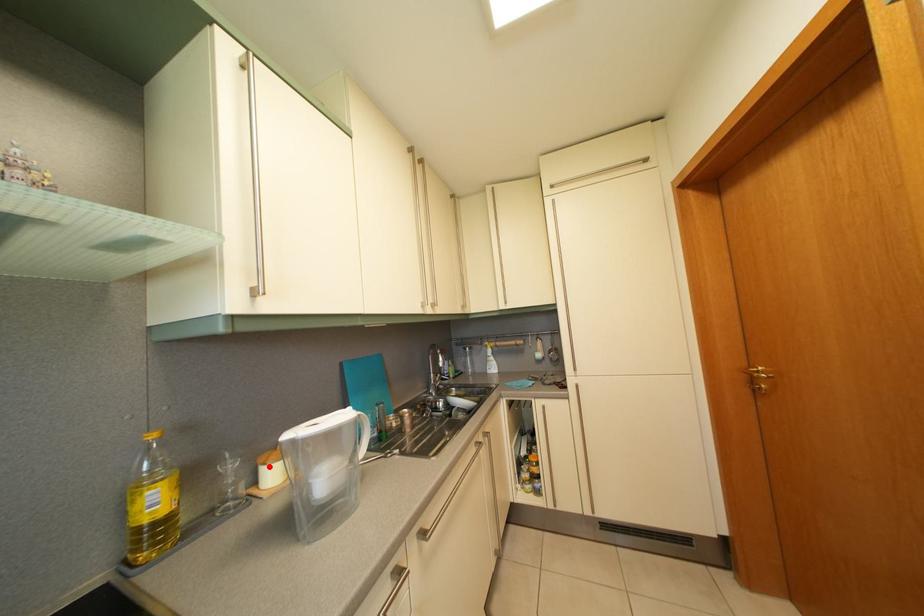
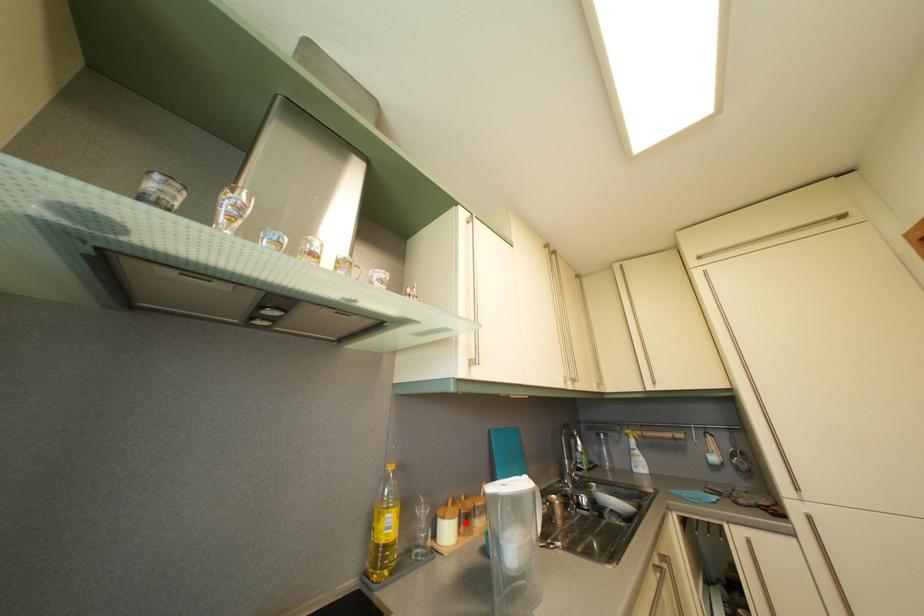
From the picture: I am providing you with two images of the same scene from different viewpoints. A red point is marked on the first image and another point is marked on the second image. Is the marked point in image1 the same physical position as the marked point in image2?

No